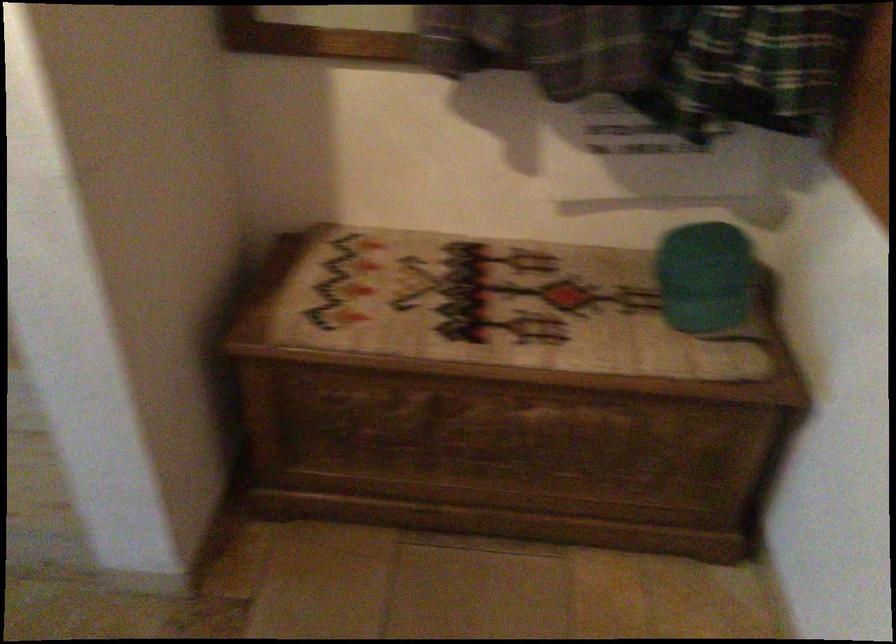
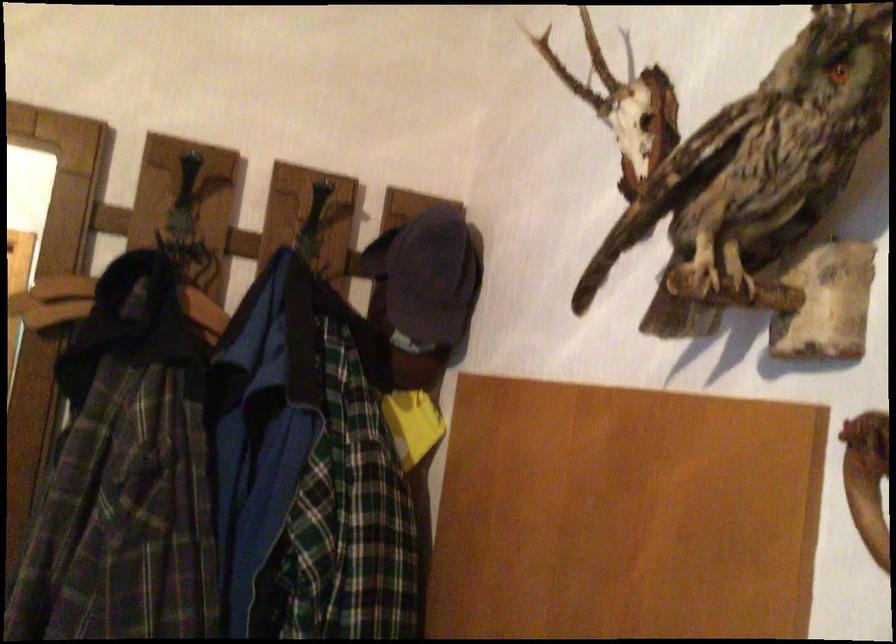
First-person continuous shooting, in which direction is the camera rotating?

The camera's rotation is toward right-up.